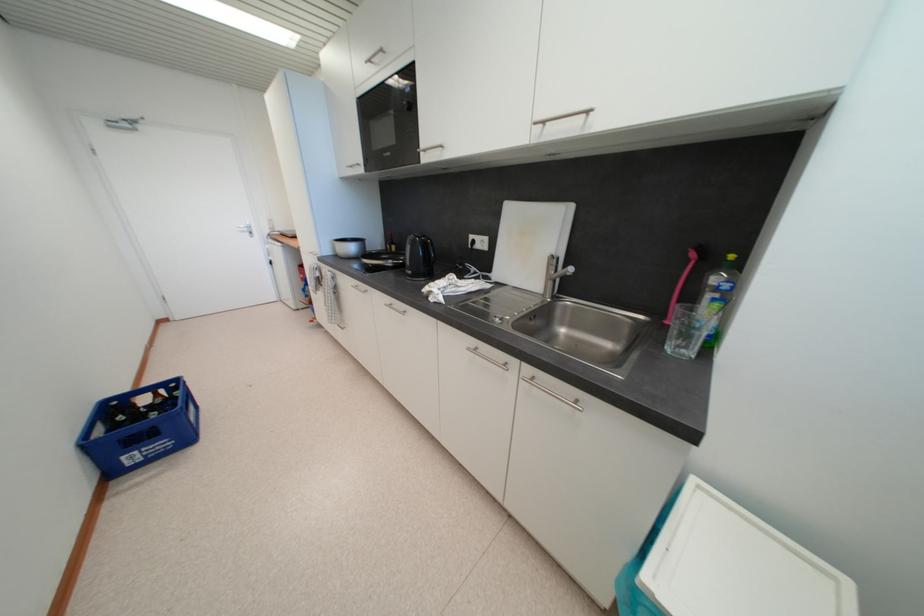
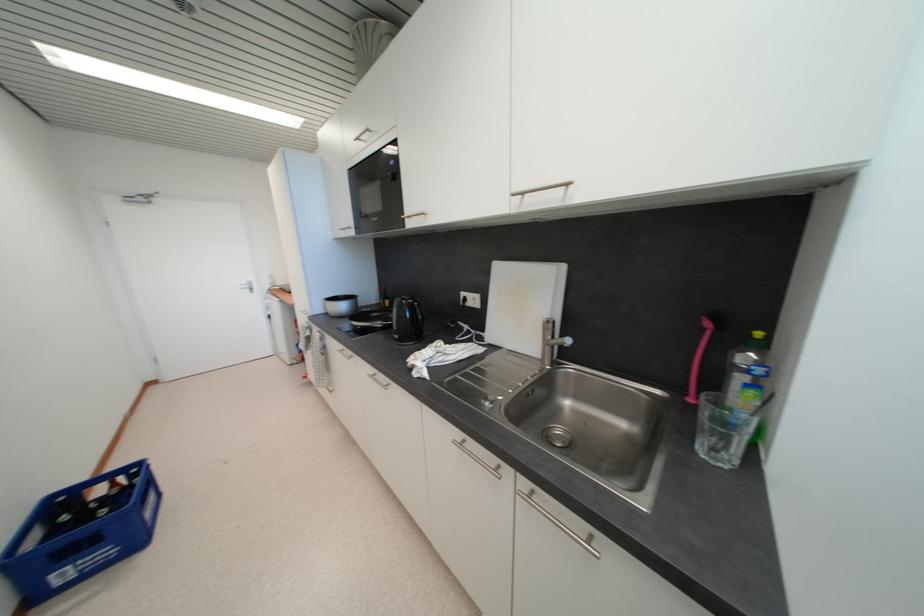
Locate, in the second image, the point that corresponds to (698,257) in the first image.

(713, 326)